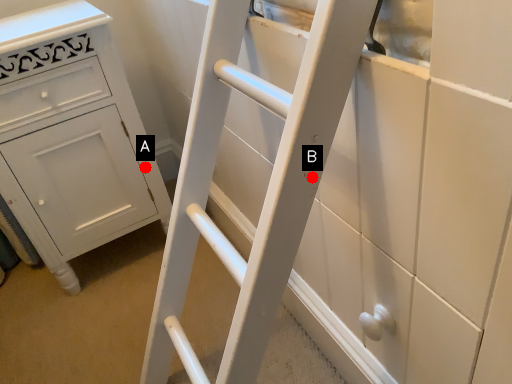
Question: Two points are circled on the image, labeled by A and B beside each circle. Among these points, which one is farthest from the camera?

Choices:
 (A) A is further
 (B) B is further

Answer: (A)